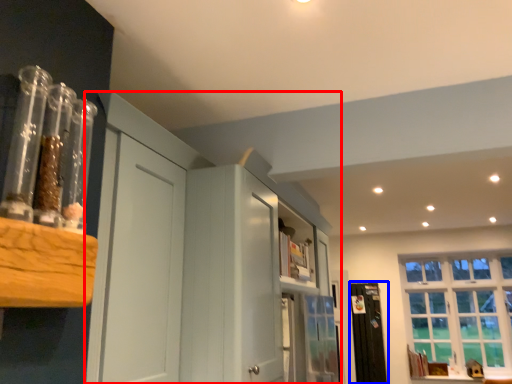
Question: Which object appears farthest to the camera in this image, dresser (highlighted by a red box) or screen door (highlighted by a blue box)?

Choices:
 (A) dresser
 (B) screen door

Answer: (B)